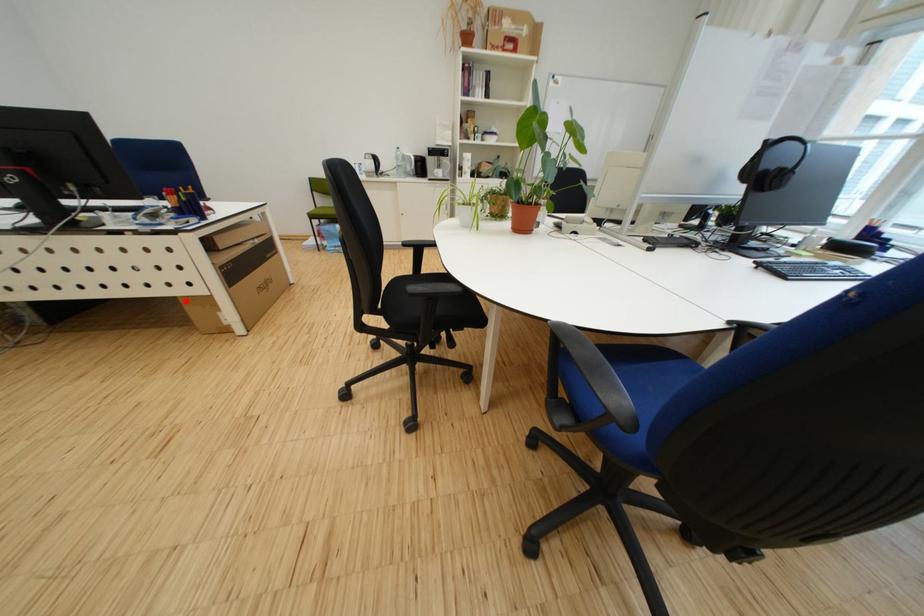
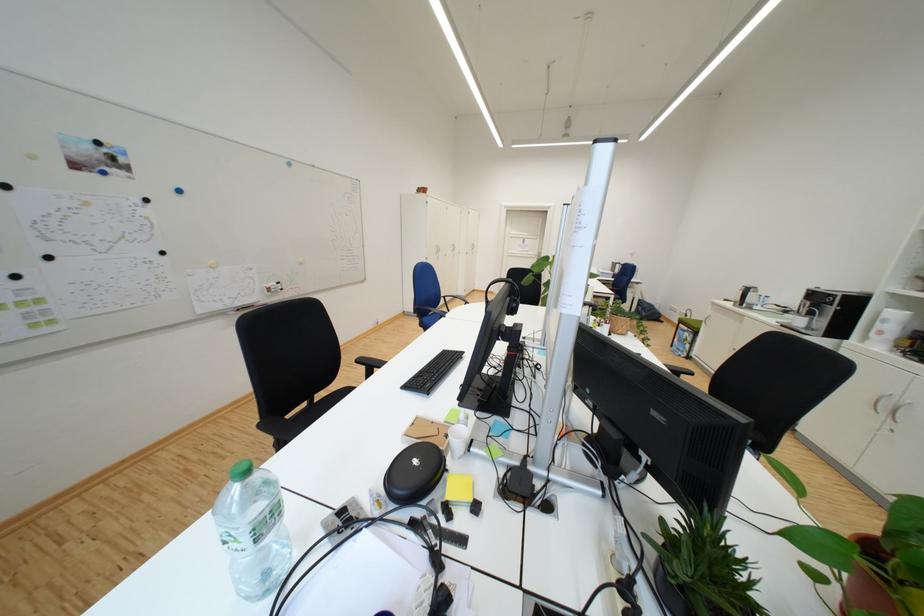
Question: I am providing you with two images of the same scene from different viewpoints. A red point is marked on the first image. Is the red point's position out of view in image 2?

Choices:
 (A) Yes
 (B) No

Answer: (A)